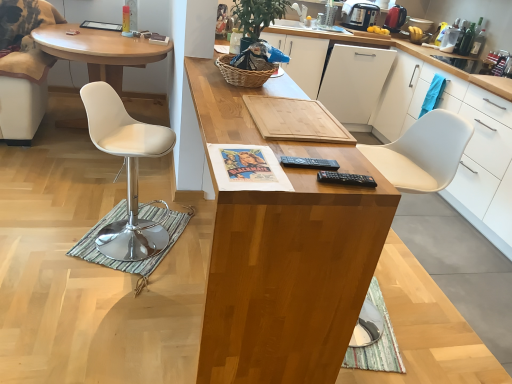
Question: Is white matte drawer at upper right beside white leather desk at left, which is counted as the second desk, starting from the front?

Choices:
 (A) no
 (B) yes

Answer: (A)

Question: Is the position of white matte drawer at upper right less distant than that of white leather desk at left, arranged as the 1th desk when viewed from the back?

Choices:
 (A) yes
 (B) no

Answer: (B)

Question: From a real-world perspective, is white matte drawer at upper right under white leather desk at left, arranged as the 1th desk when viewed from the back?

Choices:
 (A) no
 (B) yes

Answer: (A)

Question: From a real-world perspective, is white matte drawer at upper right positioned over white leather desk at left, the second desk from the right, based on gravity?

Choices:
 (A) no
 (B) yes

Answer: (B)

Question: Can you confirm if white matte drawer at upper right is taller than white leather desk at left, the 1th desk viewed from the left?

Choices:
 (A) yes
 (B) no

Answer: (B)

Question: Considering the positions of white leather desk at left, the 1th desk viewed from the left, and wooden cutting board at center, which appears as the second cabinetry when viewed from the right, in the image, is white leather desk at left, the 1th desk viewed from the left, taller or shorter than wooden cutting board at center, which appears as the second cabinetry when viewed from the right,?

Choices:
 (A) tall
 (B) short

Answer: (B)

Question: Based on their positions, is white leather desk at left, the second desk from the right, located to the left or right of wooden cutting board at center, which appears as the second cabinetry when viewed from the right?

Choices:
 (A) left
 (B) right

Answer: (A)

Question: Considering their positions, is white leather desk at left, the second desk from the right, located in front of or behind wooden cutting board at center, which appears as the second cabinetry when viewed from the right?

Choices:
 (A) front
 (B) behind

Answer: (B)

Question: From the image's perspective, relative to wooden cutting board at center, which appears as the second cabinetry when viewed from the right, is white leather desk at left, arranged as the 1th desk when viewed from the back, above or below?

Choices:
 (A) above
 (B) below

Answer: (A)

Question: From the image's perspective, relative to wooden cutting board at center, which is the 1th cabinetry from left to right, is metallic silver coffee maker at upper right above or below?

Choices:
 (A) above
 (B) below

Answer: (A)

Question: In terms of height, does metallic silver coffee maker at upper right look taller or shorter compared to wooden cutting board at center, which appears as the second cabinetry when viewed from the right?

Choices:
 (A) tall
 (B) short

Answer: (B)

Question: Which is correct: metallic silver coffee maker at upper right is inside wooden cutting board at center, which appears as the second cabinetry when viewed from the right, or outside of it?

Choices:
 (A) outside
 (B) inside

Answer: (A)

Question: In terms of width, does metallic silver coffee maker at upper right look wider or thinner when compared to wooden cutting board at center, which is the 1th cabinetry from left to right?

Choices:
 (A) wide
 (B) thin

Answer: (B)

Question: From a real-world perspective, is white matte dishwasher at center positioned above or below metallic silver coffee maker at upper right?

Choices:
 (A) below
 (B) above

Answer: (A)

Question: Is white matte dishwasher at center wider or thinner than metallic silver coffee maker at upper right?

Choices:
 (A) wide
 (B) thin

Answer: (A)